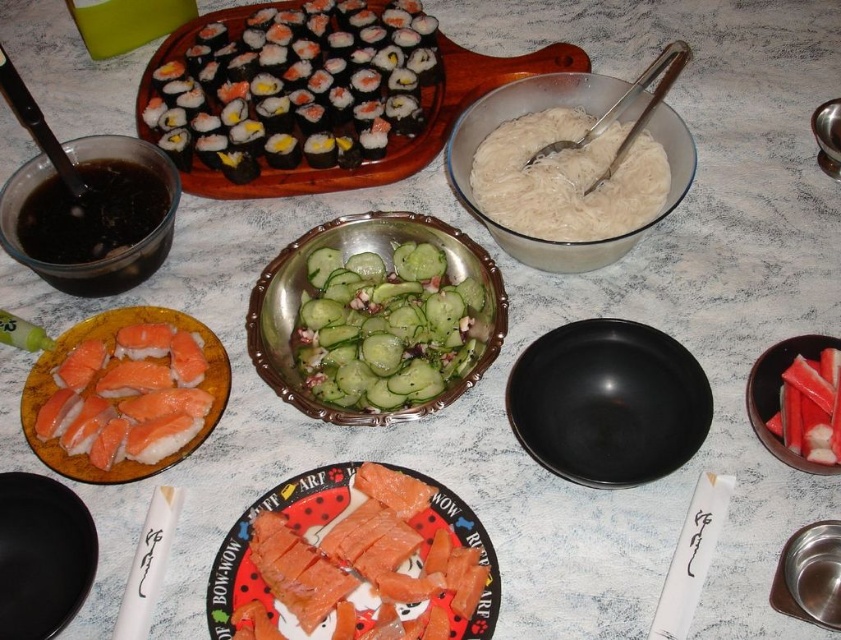
Question: Is black rice paper wrapped sushi at upper left wider than black matte bowl at center?

Choices:
 (A) no
 (B) yes

Answer: (B)

Question: Which object appears closest to the camera in this image?

Choices:
 (A) shiny dark brown bowl at upper left
 (B) brushed metal bowl at lower right

Answer: (B)

Question: Among these objects, which one is farthest from the camera?

Choices:
 (A) white paper chopstick at lower left
 (B) pinkish salmon at lower left
 (C) smooth plastic bowl at right

Answer: (B)

Question: Does pinkish salmon at center appear on the right side of pinkish salmon at lower left?

Choices:
 (A) yes
 (B) no

Answer: (A)

Question: Can you confirm if shiny dark brown bowl at upper left is bigger than smooth plastic bowl at right?

Choices:
 (A) no
 (B) yes

Answer: (B)

Question: Which of the following is the farthest from the observer?

Choices:
 (A) brushed metal bowl at lower right
 (B) white translucent noodles at upper center

Answer: (B)